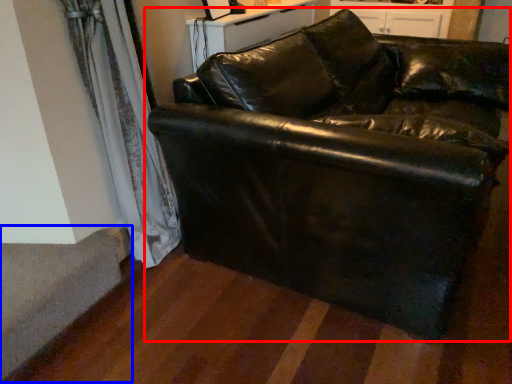
Question: Which object appears closest to the camera in this image, studio couch (highlighted by a red box) or stairwell (highlighted by a blue box)?

Choices:
 (A) studio couch
 (B) stairwell

Answer: (A)